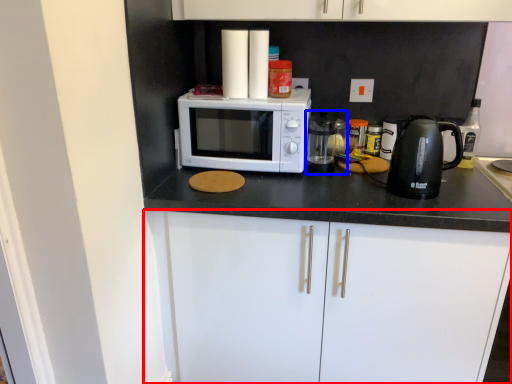
Question: Among these objects, which one is farthest to the camera, cabinetry (highlighted by a red box) or appliance (highlighted by a blue box)?

Choices:
 (A) cabinetry
 (B) appliance

Answer: (B)